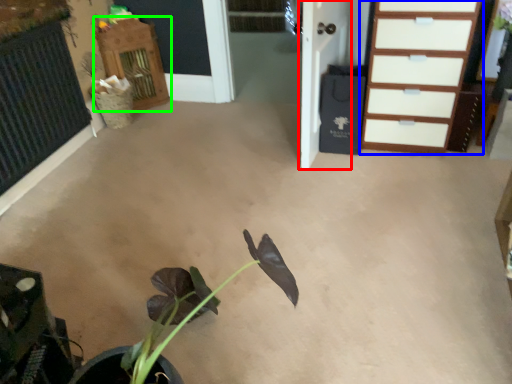
Question: Considering the real-world distances, which object is closest to door (highlighted by a red box)? chest of drawers (highlighted by a blue box) or dresser (highlighted by a green box).

Choices:
 (A) chest of drawers
 (B) dresser

Answer: (A)